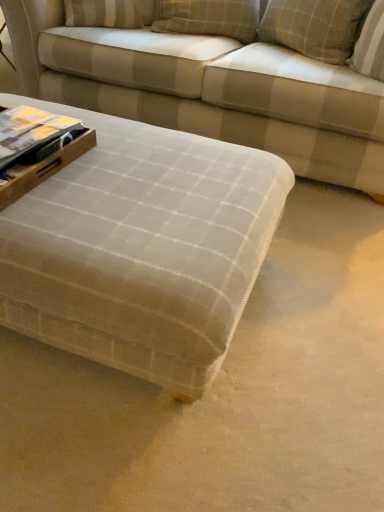
The image size is (384, 512). Find the location of `free space above textured beige ottoman at center (from a real-world perspective)`. free space above textured beige ottoman at center (from a real-world perspective) is located at coordinates (132, 176).